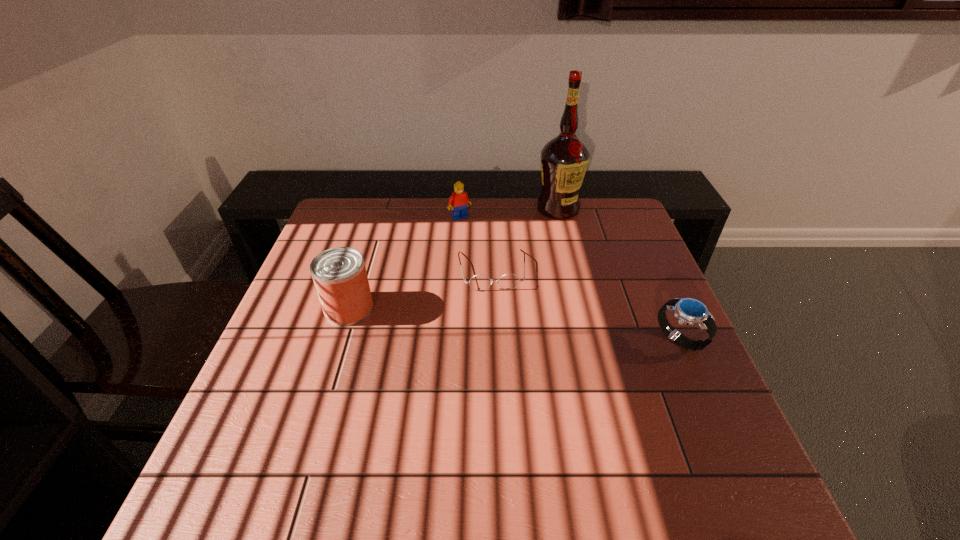
In order to click on blank space located on the left of the rightmost object in this screenshot , I will do `click(560, 340)`.

Locate an element on the screen. This screenshot has width=960, height=540. free space located 0.220m on the label of the alcohol is located at coordinates (549, 263).

Locate an element on the screen. The height and width of the screenshot is (540, 960). vacant region located 0.320m on the label of the alcohol is located at coordinates (545, 286).

What are the coordinates of `blank space located on the label of the alcohol` in the screenshot? It's located at (552, 242).

I want to click on vacant space located through the lenses of the third nearest object, so click(x=502, y=368).

Find the location of a particular element. This screenshot has height=540, width=960. vacant area situated through the lenses of the third nearest object is located at coordinates (496, 314).

Image resolution: width=960 pixels, height=540 pixels. What are the coordinates of `free space located through the lenses of the third nearest object` in the screenshot? It's located at (501, 357).

Find the location of `vacant area situated on the face of the Lego`. vacant area situated on the face of the Lego is located at coordinates (521, 291).

At what (x,y) coordinates should I click in order to perform the action: click on free region located on the face of the Lego. Please return your answer as a coordinate pair (x, y). This screenshot has height=540, width=960. Looking at the image, I should click on [x=497, y=261].

Identify the location of free space located on the face of the Lego. (497, 261).